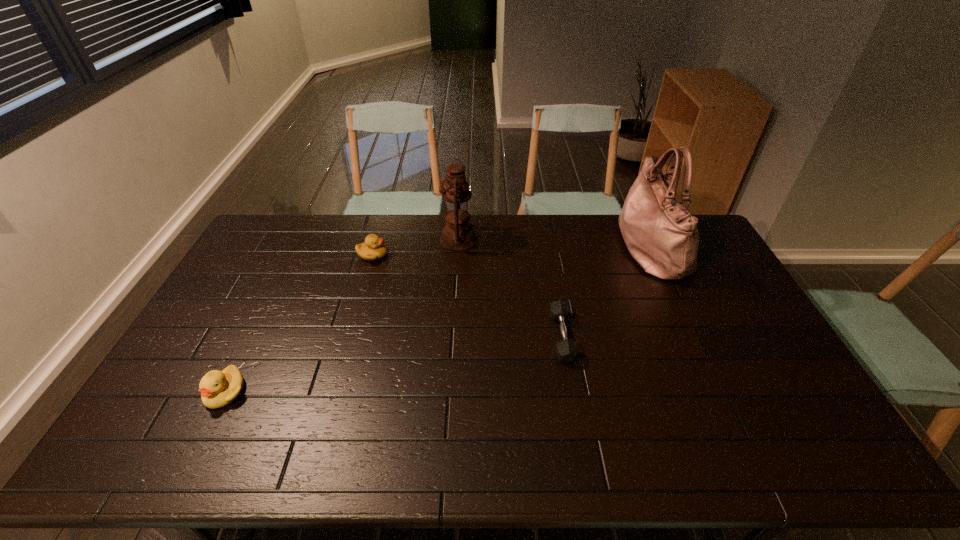
This screenshot has height=540, width=960. What are the coordinates of `free point between the left duckling and the tallest object` in the screenshot? It's located at (438, 319).

Identify the location of free space between the second nearest object and the farther duckling. pyautogui.click(x=468, y=296).

This screenshot has height=540, width=960. I want to click on unoccupied area between the second nearest object and the rightmost object, so click(x=606, y=292).

Identify the location of vacant area that lies between the nearer duckling and the fourth object from right to left. The height and width of the screenshot is (540, 960). (299, 323).

In order to click on empty space that is in between the fourth object from left to right and the leftmost object in this screenshot , I will do `click(394, 364)`.

You are a GUI agent. You are given a task and a screenshot of the screen. Output one action in this format:
    pyautogui.click(x=<x>, y=<y>)
    Task: Click on the blank region between the fourth object from right to left and the third object from right to left
    This screenshot has width=960, height=540.
    Given the screenshot: What is the action you would take?
    pyautogui.click(x=416, y=247)

Identify the location of vacant space in between the tallest object and the oil lamp. The height and width of the screenshot is (540, 960). (554, 244).

I want to click on vacant space that is in between the fourth farthest object and the handbag, so click(606, 292).

At what (x,y) coordinates should I click in order to perform the action: click on object identified as the second closest to the rightmost object. Please return your answer as a coordinate pair (x, y). Image resolution: width=960 pixels, height=540 pixels. Looking at the image, I should click on (458, 234).

You are a GUI agent. You are given a task and a screenshot of the screen. Output one action in this format:
    pyautogui.click(x=<x>, y=<y>)
    Task: Click on the fourth closest object to the tallest object
    This screenshot has height=540, width=960.
    Given the screenshot: What is the action you would take?
    pyautogui.click(x=218, y=389)